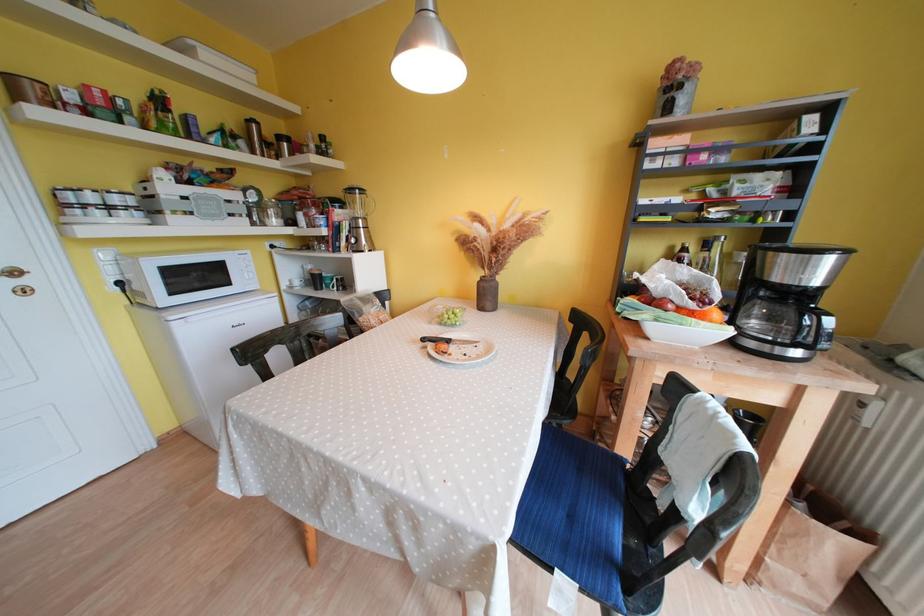
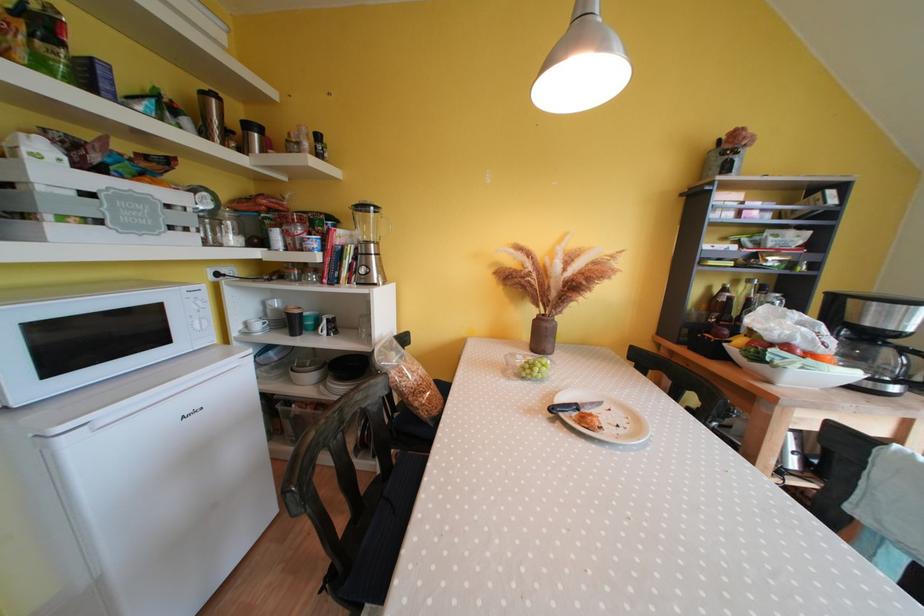
Locate, in the second image, the point that corresponds to point (374, 299) in the first image.

(397, 345)